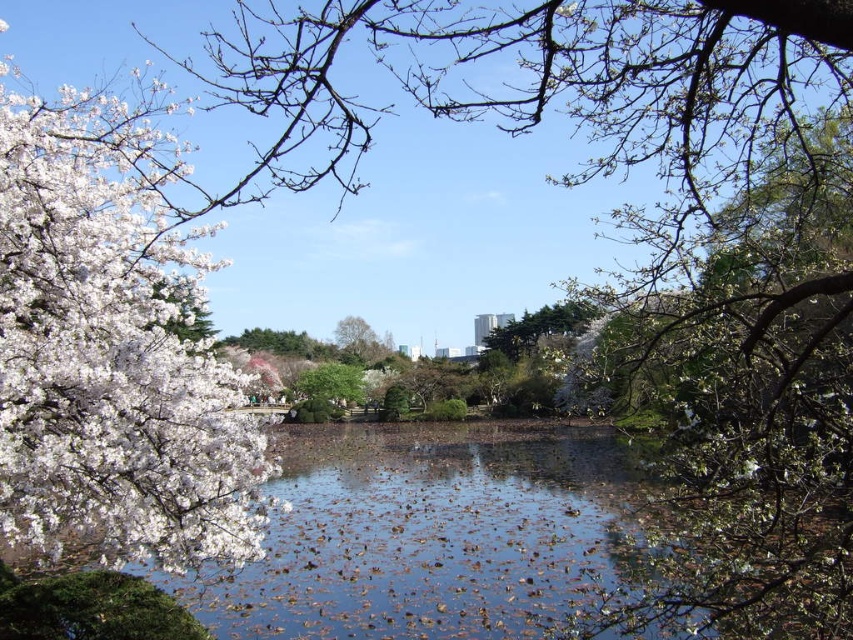
Question: Which point is farther from the camera taking this photo?

Choices:
 (A) (525, 342)
 (B) (160, 198)

Answer: (A)

Question: Among these points, which one is farthest from the camera?

Choices:
 (A) (123, 109)
 (B) (567, 317)

Answer: (B)

Question: Is white matte flower at left wider than green leafy tree at center?

Choices:
 (A) yes
 (B) no

Answer: (B)

Question: Is white matte flower at left bigger than green leafy tree at center?

Choices:
 (A) no
 (B) yes

Answer: (A)

Question: Is white matte flower at left above green leafy tree at center?

Choices:
 (A) yes
 (B) no

Answer: (B)